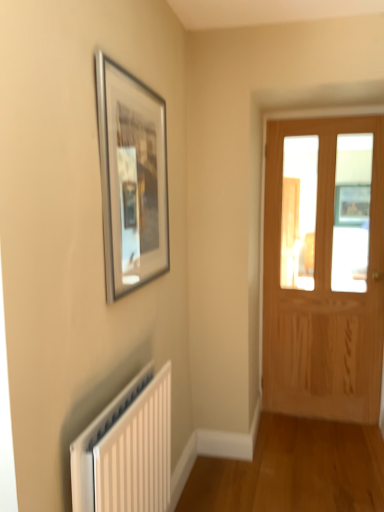
Question: Considering their positions, is silver metallic picture frame at upper left located in front of or behind light brown wooden door at right?

Choices:
 (A) behind
 (B) front

Answer: (B)

Question: From the image's perspective, is silver metallic picture frame at upper left above or below light brown wooden door at right?

Choices:
 (A) below
 (B) above

Answer: (B)

Question: Based on their relative distances, which object is farther from the white plastic radiator at lower left?

Choices:
 (A) silver metallic picture frame at upper left
 (B) light brown wooden door at right

Answer: (B)

Question: Which object is the farthest from the light brown wooden door at right?

Choices:
 (A) white plastic radiator at lower left
 (B) silver metallic picture frame at upper left

Answer: (A)